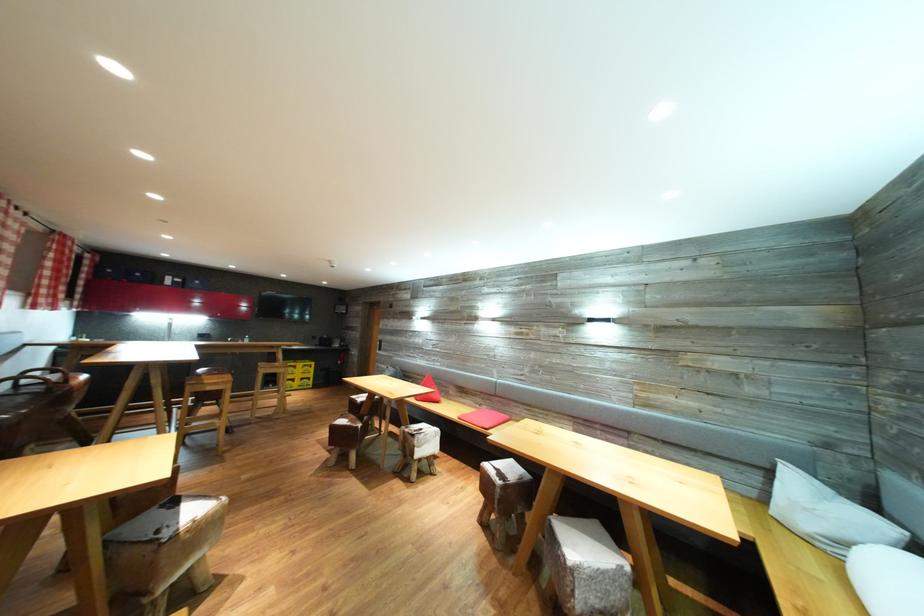
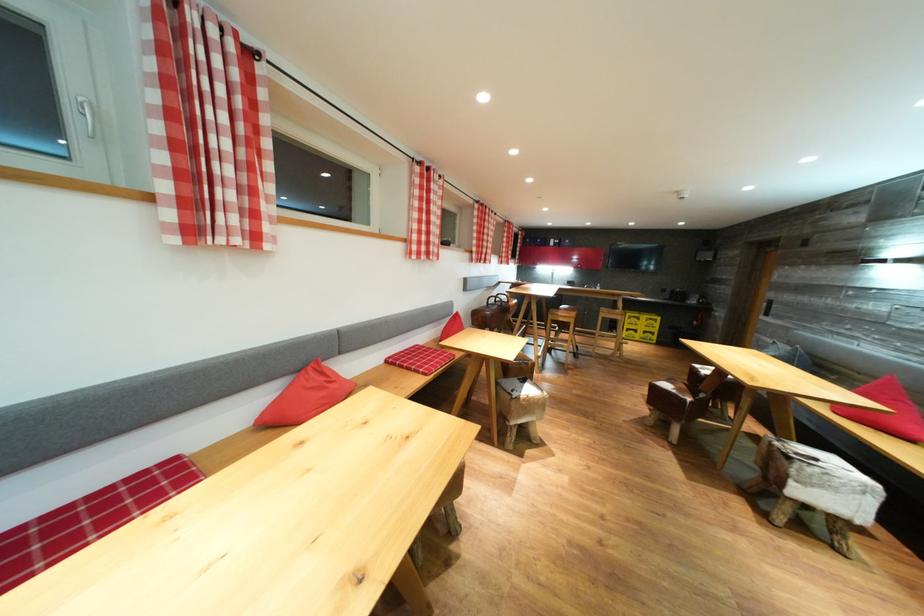
Locate, in the second image, the point that corresponds to point 307,370 in the first image.

(650, 323)